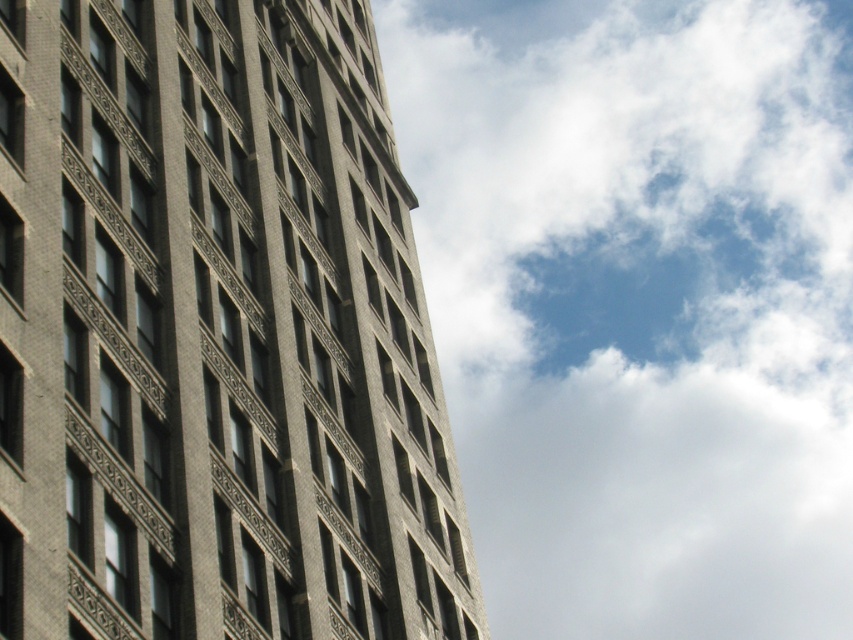
You are standing in the middle of a city square and looking up at the gray brick building at center. What are the coordinates of the building in this 2D view?

The coordinates of the gray brick building at center in this 2D view are at point (215, 333).

You are standing at the base of the building and want to reach a specific point on the building facade at coordinates point (x=202, y=1). If your ladder can extend up to 150 feet, will it be sufficient to reach that point?

The distance of point (x=202, y=1) from viewer is 186.25 feet, so the ladder that can extend up to 150 feet is not sufficient to reach the point.